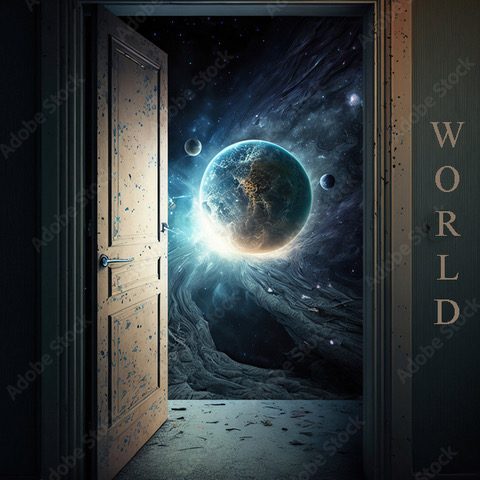
Image resolution: width=480 pixels, height=480 pixels. In order to click on door in this screenshot , I will do `click(122, 212)`.